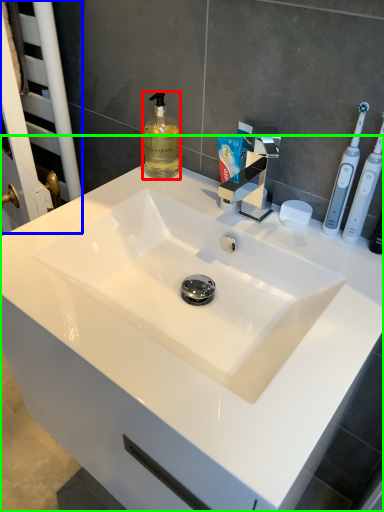
Question: Which object is the farthest from soap dispenser (highlighted by a red box)? Choose among these: screen door (highlighted by a blue box) or sink (highlighted by a green box).

Choices:
 (A) screen door
 (B) sink

Answer: (B)